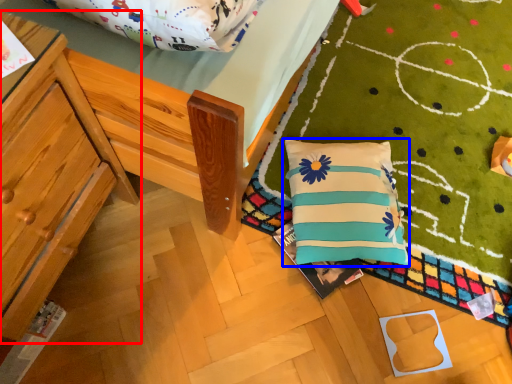
Question: Which of the following is the closest to the observer, furniture (highlighted by a red box) or pillow (highlighted by a blue box)?

Choices:
 (A) furniture
 (B) pillow

Answer: (A)